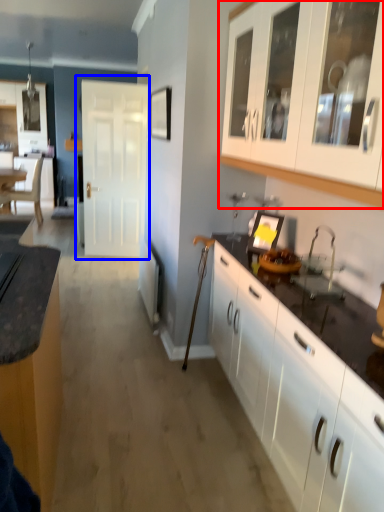
Question: Which point is closer to the camera, cabinetry (highlighted by a red box) or door (highlighted by a blue box)?

Choices:
 (A) cabinetry
 (B) door

Answer: (A)